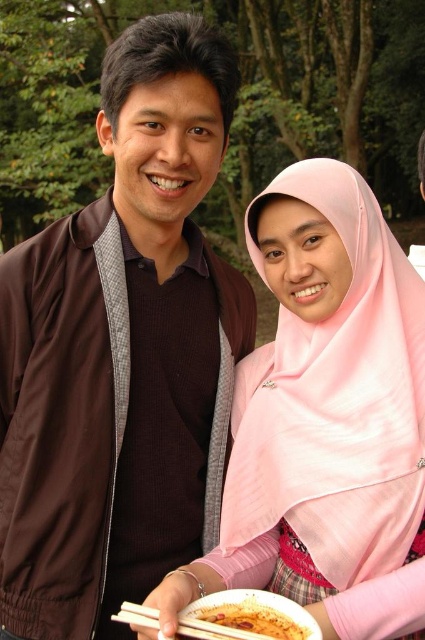
You are at a party and want to take a photo of both the brown matte jacket at left and the pink satin hijab at center without anyone blocking them. Is the current arrangement possible?

The pink satin hijab at center is behind the brown matte jacket at left, so taking a photo of both without obstruction might not be possible as the brown matte jacket at left is in front of the pink satin hijab at center.

From the picture: You are at a social event and see the brown matte jacket at left and the white matte chopsticks at lower center. Which object is positioned more to the left?

The brown matte jacket at left is positioned more to the left than the white matte chopsticks at lower center.

You are a photographer at this event and need to capture both the pink satin hijab at center and the white matte chopsticks at lower center in a single closeup shot. Which object should you focus on first to ensure both are in frame?

The pink satin hijab at center is larger in size than the white matte chopsticks at lower center, so you should focus on the pink satin hijab at center first to ensure both objects fit within the frame.